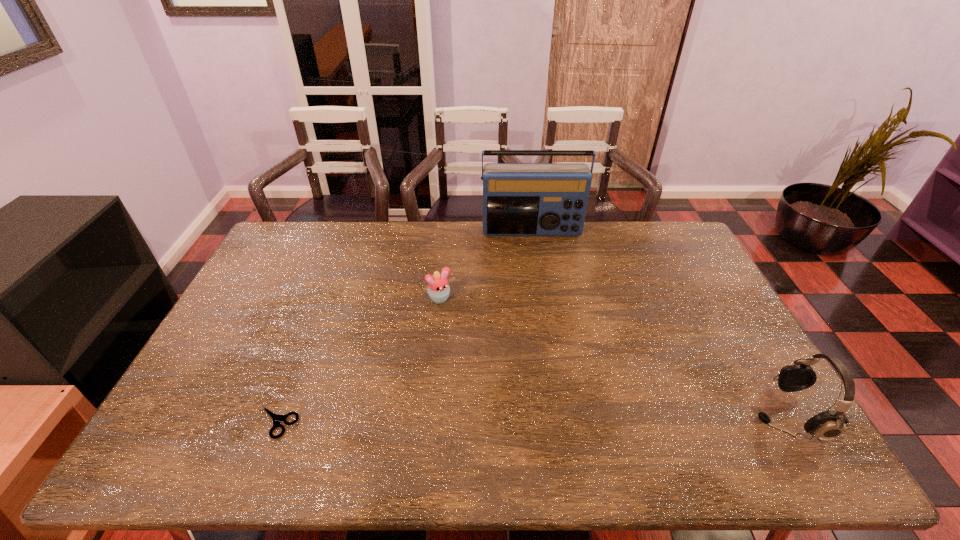
The height and width of the screenshot is (540, 960). Find the location of `free space located with the microphone on the side of the second tallest object`. free space located with the microphone on the side of the second tallest object is located at coordinates (611, 414).

Identify the location of free space located with the microphone on the side of the second tallest object. (622, 414).

Image resolution: width=960 pixels, height=540 pixels. I want to click on vacant area located on the face of the third nearest object, so click(x=471, y=337).

Find the location of a particular element. The image size is (960, 540). free space located 0.210m on the face of the third nearest object is located at coordinates (481, 350).

Identify the location of free space located 0.300m on the face of the third nearest object. (498, 373).

This screenshot has width=960, height=540. Find the location of `free space located 0.180m on the front panel of the tallest object`. free space located 0.180m on the front panel of the tallest object is located at coordinates (538, 271).

The width and height of the screenshot is (960, 540). I want to click on free space located 0.280m on the front panel of the tallest object, so click(x=540, y=291).

What are the coordinates of `free spot located 0.070m on the front panel of the tallest object` in the screenshot? It's located at (535, 252).

Locate an element on the screen. The height and width of the screenshot is (540, 960). object located in the far edge section of the desktop is located at coordinates (519, 199).

Image resolution: width=960 pixels, height=540 pixels. Identify the location of shears located at the near edge. (276, 418).